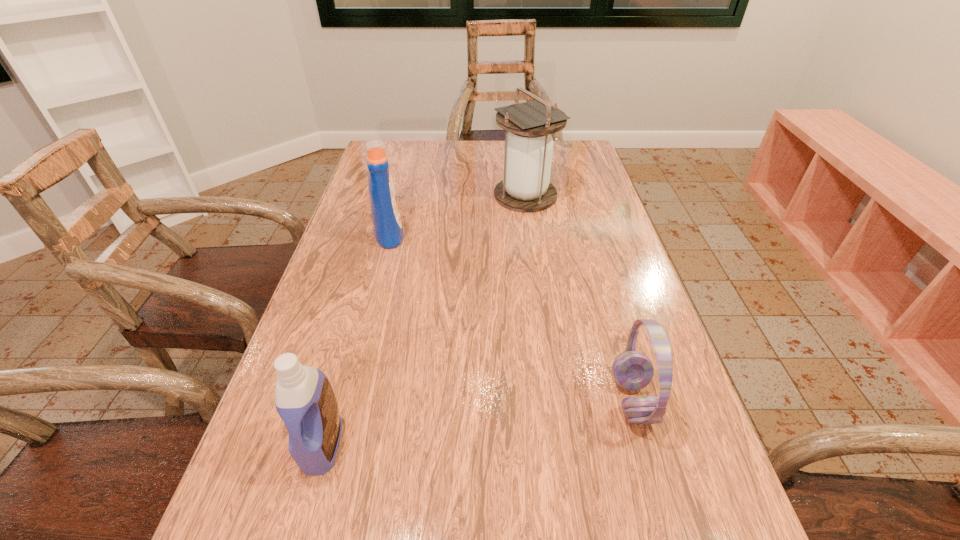
Where is `free space located on the back of the third tallest object`? free space located on the back of the third tallest object is located at coordinates (372, 269).

Identify the location of free region located 0.360m on the headband and ear cups of the rightmost object. Image resolution: width=960 pixels, height=540 pixels. (416, 400).

In order to click on free region located on the headband and ear cups of the rightmost object in this screenshot , I will do pos(515,400).

Where is `free space located 0.290m on the headband and ear cups of the rightmost object`? The image size is (960, 540). free space located 0.290m on the headband and ear cups of the rightmost object is located at coordinates (454, 400).

In order to click on lantern located at the right edge in this screenshot , I will do `click(528, 148)`.

You are a GUI agent. You are given a task and a screenshot of the screen. Output one action in this format:
    pyautogui.click(x=<x>, y=<y>)
    Task: Click on the headset that is at the right edge
    The width and height of the screenshot is (960, 540).
    Given the screenshot: What is the action you would take?
    pyautogui.click(x=632, y=370)

In the image, there is a desktop. At what (x,y) coordinates should I click in order to perform the action: click on vacant space at the far edge. Please return your answer as a coordinate pair (x, y). Looking at the image, I should click on (447, 168).

At what (x,y) coordinates should I click in order to perform the action: click on free region at the right edge. Please return your answer as a coordinate pair (x, y). The width and height of the screenshot is (960, 540). Looking at the image, I should click on (608, 225).

The width and height of the screenshot is (960, 540). Identify the location of blank space at the far left corner of the desktop. (407, 145).

At what (x,y) coordinates should I click in order to perform the action: click on free space at the far right corner of the desktop. Please return your answer as a coordinate pair (x, y). The width and height of the screenshot is (960, 540). Looking at the image, I should click on (587, 173).